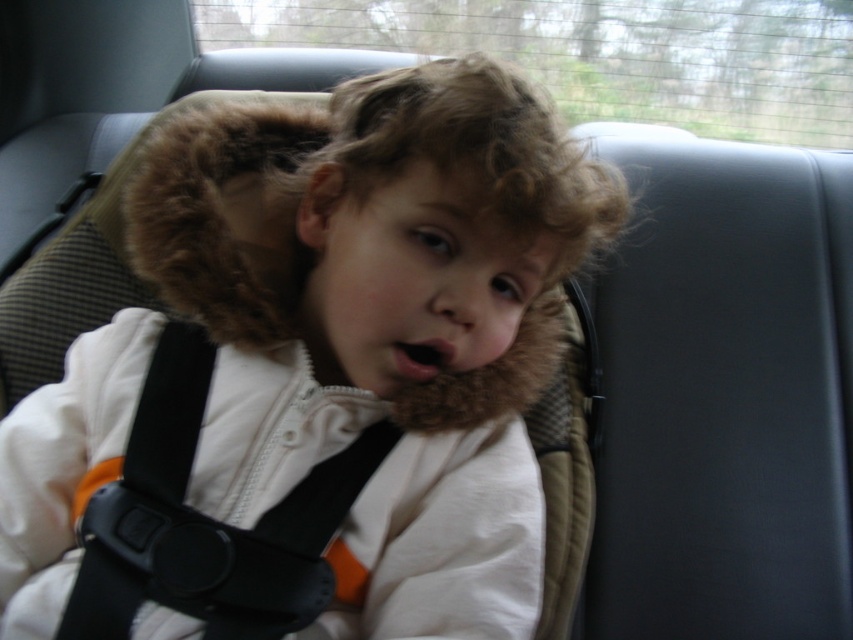
Does point (521, 204) lie in front of point (184, 596)?

Yes, point (521, 204) is closer to viewer.

Which is in front, point (556, 333) or point (157, 474)?

Point (157, 474) is more forward.

Find the location of a particular element. The image size is (853, 640). white fleece jacket at center is located at coordinates (314, 376).